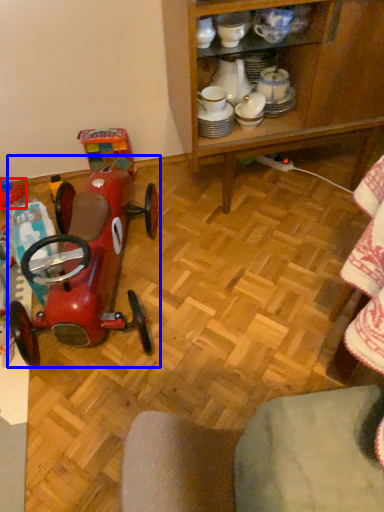
Question: Among these objects, which one is farthest to the camera, toy (highlighted by a red box) or toy (highlighted by a blue box)?

Choices:
 (A) toy
 (B) toy

Answer: (A)